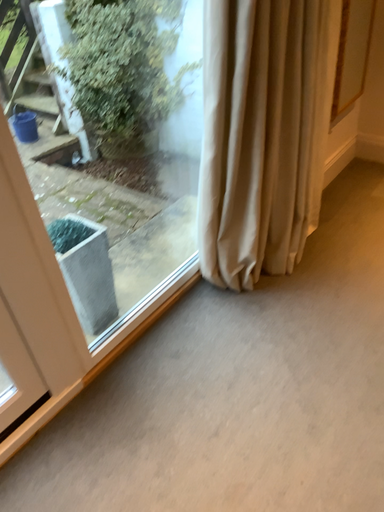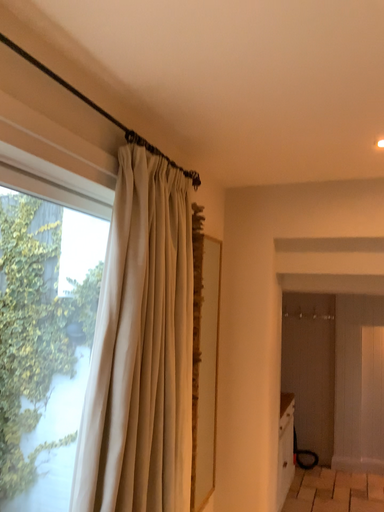
Question: How did the camera likely rotate when shooting the video?

Choices:
 (A) rotated left
 (B) rotated right

Answer: (B)